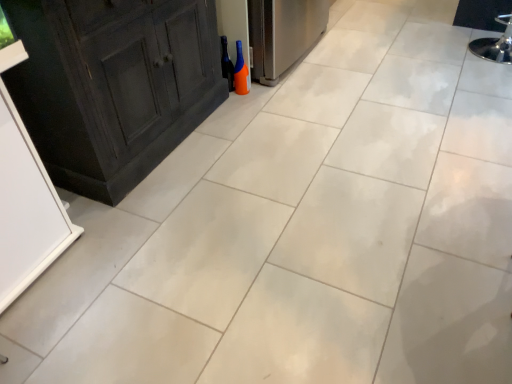
Where is `empty space that is to the right of black glass wine bottle at center`? empty space that is to the right of black glass wine bottle at center is located at coordinates (261, 83).